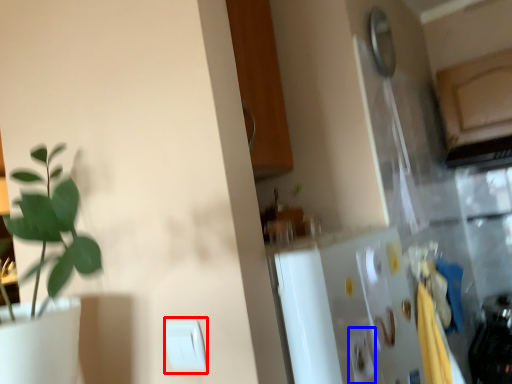
Question: Which point is closer to the camera, light switch (highlighted by a red box) or light switch (highlighted by a blue box)?

Choices:
 (A) light switch
 (B) light switch

Answer: (A)